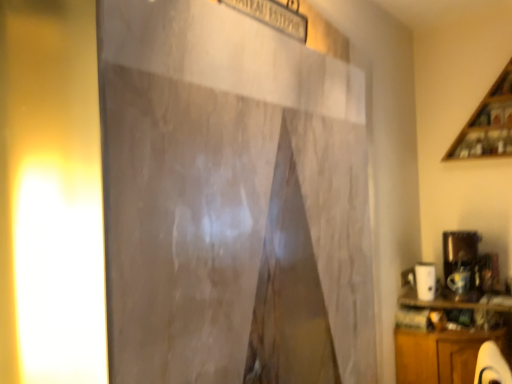
The image size is (512, 384). What do you see at coordinates (59, 270) in the screenshot? I see `yellow matte light at left` at bounding box center [59, 270].

Find the location of a particular element. wooden cabinet at lower right is located at coordinates (442, 354).

Is there a large distance between wooden at upper right and wooden cabinet at lower right?

Yes.

Considering the positions of objects wooden at upper right and wooden cabinet at lower right in the image provided, who is more to the left, wooden at upper right or wooden cabinet at lower right?

Positioned to the left is wooden cabinet at lower right.

Considering the points (490, 150) and (413, 356), which point is in front, point (490, 150) or point (413, 356)?

Positioned in front is point (413, 356).

From a real-world perspective, which object rests below the other?

wooden cabinet at lower right.

Between yellow matte light at left and wooden at upper right, which one appears on the left side from the viewer's perspective?

From the viewer's perspective, yellow matte light at left appears more on the left side.

Is yellow matte light at left next to wooden at upper right?

No, yellow matte light at left is not beside wooden at upper right.

Which of these two, yellow matte light at left or wooden at upper right, stands taller?

Standing taller between the two is yellow matte light at left.

Is wooden at upper right not within yellow matte light at left?

That's correct, wooden at upper right is outside of yellow matte light at left.

Looking at this image, which is less distant, (x=506, y=108) or (x=39, y=278)?

Positioned in front is point (x=39, y=278).

Between wooden at upper right and yellow matte light at left, which one has less height?

Standing shorter between the two is wooden at upper right.

Is wooden at upper right positioned far away from yellow matte light at left?

Yes, wooden at upper right is far from yellow matte light at left.

At what (x,y) coordinates should I click in order to perform the action: click on light located on the left of wooden cabinet at lower right. Please return your answer as a coordinate pair (x, y). Looking at the image, I should click on (59, 270).

Looking at this image, from a real-world perspective, is wooden cabinet at lower right below yellow matte light at left?

Yes, from a real-world perspective, wooden cabinet at lower right is under yellow matte light at left.

Between wooden cabinet at lower right and yellow matte light at left, which one appears on the left side from the viewer's perspective?

From the viewer's perspective, yellow matte light at left appears more on the left side.

From a real-world perspective, which object rests below the other?

wooden cabinet at lower right, from a real-world perspective.

Is yellow matte light at left far from wooden cabinet at lower right?

yellow matte light at left is positioned a significant distance from wooden cabinet at lower right.

From the image's perspective, is yellow matte light at left above wooden cabinet at lower right?

Yes, from the image's perspective, yellow matte light at left is above wooden cabinet at lower right.

Can you confirm if wooden cabinet at lower right is shorter than wooden at upper right?

Indeed, wooden cabinet at lower right has a lesser height compared to wooden at upper right.

Considering the relative sizes of wooden cabinet at lower right and wooden at upper right in the image provided, is wooden cabinet at lower right thinner than wooden at upper right?

In fact, wooden cabinet at lower right might be wider than wooden at upper right.

Between wooden cabinet at lower right and wooden at upper right, which one appears on the right side from the viewer's perspective?

wooden at upper right is more to the right.

In order to click on shelf on the right side of wooden cabinet at lower right in this screenshot , I will do `click(488, 124)`.

The image size is (512, 384). I want to click on cabinetry in front of the wooden at upper right, so click(442, 354).

At what (x,y) coordinates should I click in order to perform the action: click on light on the left of wooden at upper right. Please return your answer as a coordinate pair (x, y). Looking at the image, I should click on (59, 270).

Which object lies further to the anchor point yellow matte light at left, wooden at upper right or wooden cabinet at lower right?

Based on the image, wooden at upper right appears to be further to yellow matte light at left.

Considering their positions, is wooden at upper right positioned closer to wooden cabinet at lower right than yellow matte light at left?

wooden at upper right is positioned closer to the anchor wooden cabinet at lower right.

In the scene shown: Looking at the image, which one is located further to yellow matte light at left, wooden cabinet at lower right or wooden at upper right?

wooden at upper right.

Consider the image. From the image, which object appears to be nearer to wooden cabinet at lower right, yellow matte light at left or wooden at upper right?

The object closer to wooden cabinet at lower right is wooden at upper right.

From the image, which object appears to be farther from wooden at upper right, yellow matte light at left or wooden cabinet at lower right?

Based on the image, yellow matte light at left appears to be further to wooden at upper right.

Based on their spatial positions, is wooden cabinet at lower right or yellow matte light at left closer to wooden at upper right?

wooden cabinet at lower right lies closer to wooden at upper right than the other object.

Locate an element on the screen. cabinetry between yellow matte light at left and wooden at upper right is located at coordinates (442, 354).